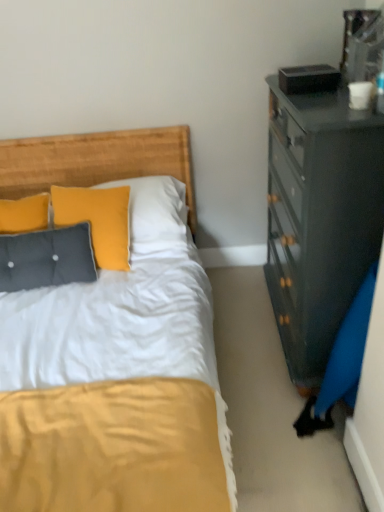
Question: Is tufted fabric pillow at left far from wooden headboard at upper left?

Choices:
 (A) yes
 (B) no

Answer: (B)

Question: Is tufted fabric pillow at left in front of wooden headboard at upper left?

Choices:
 (A) yes
 (B) no

Answer: (A)

Question: Does tufted fabric pillow at left touch wooden headboard at upper left?

Choices:
 (A) no
 (B) yes

Answer: (A)

Question: Considering the relative sizes of tufted fabric pillow at left and wooden headboard at upper left in the image provided, is tufted fabric pillow at left smaller than wooden headboard at upper left?

Choices:
 (A) no
 (B) yes

Answer: (B)

Question: Is tufted fabric pillow at left oriented towards wooden headboard at upper left?

Choices:
 (A) no
 (B) yes

Answer: (A)

Question: From the image's perspective, is tufted fabric pillow at left on wooden headboard at upper left?

Choices:
 (A) no
 (B) yes

Answer: (A)

Question: Does wooden headboard at upper left lie behind tufted fabric pillow at left?

Choices:
 (A) yes
 (B) no

Answer: (A)

Question: Is wooden headboard at upper left thinner than tufted fabric pillow at left?

Choices:
 (A) yes
 (B) no

Answer: (B)

Question: Can we say wooden headboard at upper left lies outside tufted fabric pillow at left?

Choices:
 (A) yes
 (B) no

Answer: (A)

Question: Is wooden headboard at upper left at the right side of tufted fabric pillow at left?

Choices:
 (A) yes
 (B) no

Answer: (A)

Question: Are wooden headboard at upper left and tufted fabric pillow at left making contact?

Choices:
 (A) yes
 (B) no

Answer: (B)

Question: Is wooden headboard at upper left to the left of tufted fabric pillow at left from the viewer's perspective?

Choices:
 (A) yes
 (B) no

Answer: (B)

Question: Considering the positions of tufted fabric pillow at left and wooden headboard at upper left in the image, is tufted fabric pillow at left wider or thinner than wooden headboard at upper left?

Choices:
 (A) wide
 (B) thin

Answer: (B)